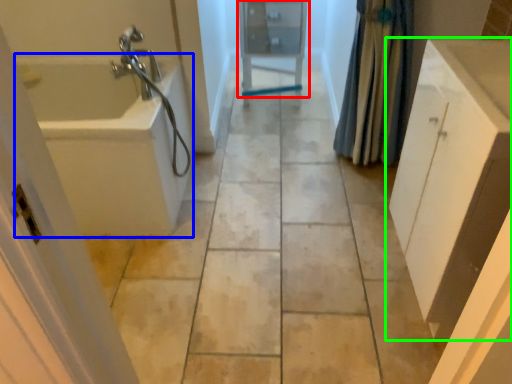
Question: Which object is the closest to the medicine cabinet (highlighted by a red box)? Choose among these: bath (highlighted by a blue box) or bathroom cabinet (highlighted by a green box).

Choices:
 (A) bath
 (B) bathroom cabinet

Answer: (A)